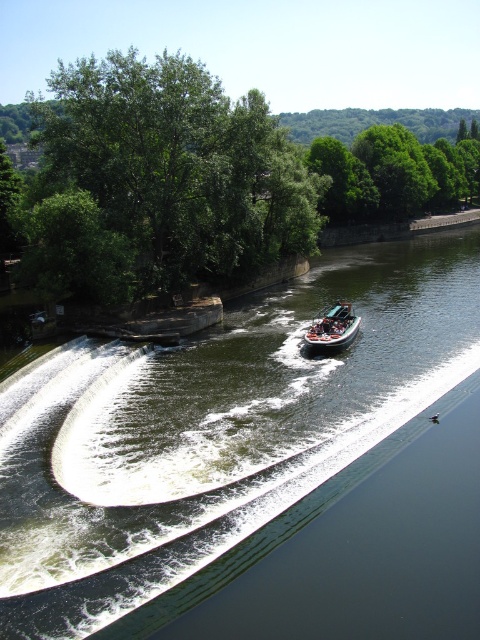
You are standing on the riverside and want to take a photo of the green smooth water at center. Where should you position yourself to capture it in the best possible frame?

The green smooth water at center is located at point (214, 429), so position yourself at that coordinate to capture it best.

You are a photographer standing at the riverside and want to capture a photo that includes both the green leafy tree at upper left and the green leafy trees at upper center. Based on their positions, which tree is positioned higher in the frame?

The green leafy tree at upper left is located above the green leafy trees at upper center, so it is positioned higher in the frame.

You are standing at the point marked as point (202, 179) in the image. Looking around, you see a green leafy tree at upper left. What is the nearest object to you in this riverside scene?

The nearest object to you at point (202, 179) is the green leafy tree at upper left because it is located at that exact coordinate.